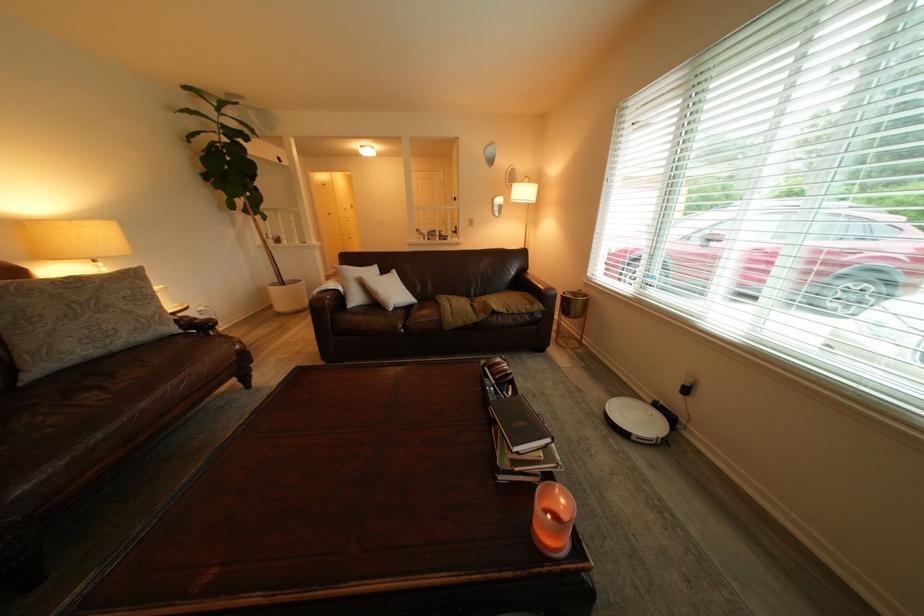
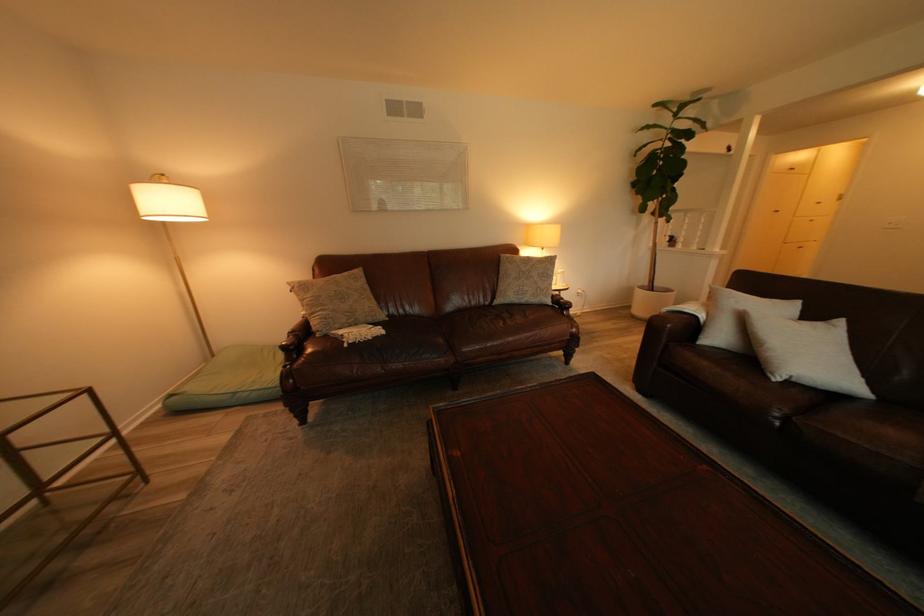
Question: How did the camera likely rotate?

Choices:
 (A) Left
 (B) Right
 (C) Up
 (D) Down

Answer: (A)